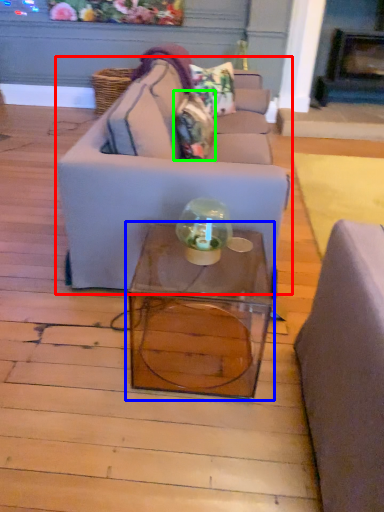
Question: Estimate the real-world distances between objects in this image. Which object is closer to studio couch (highlighted by a red box), table (highlighted by a blue box) or pillow (highlighted by a green box)?

Choices:
 (A) table
 (B) pillow

Answer: (A)